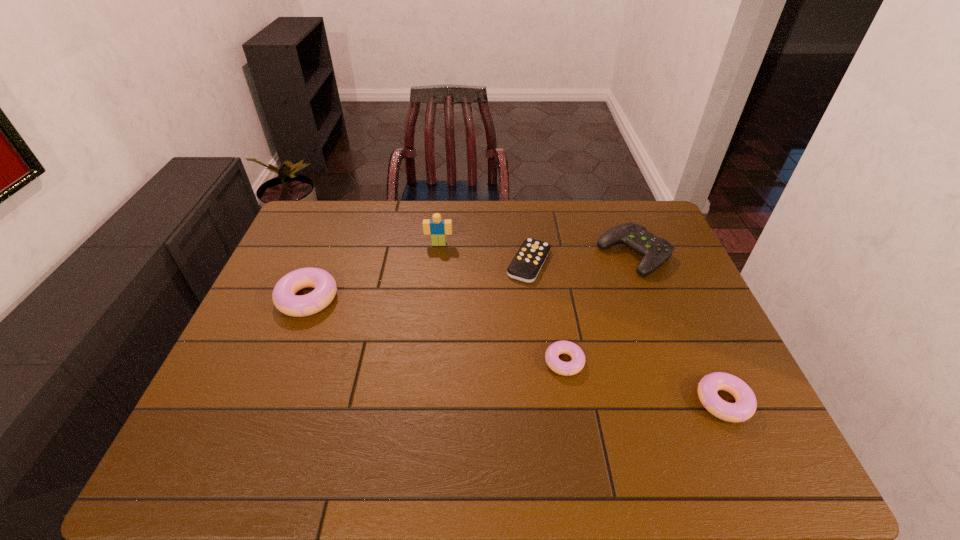
Please determine a free point for an extra doughnut to ensure balance. Please provide its 2D coordinates. Your answer should be formatted as a tuple, i.e. [(x, y)], where the tuple contains the x and y coordinates of a point satisfying the conditions above.

[(427, 328)]